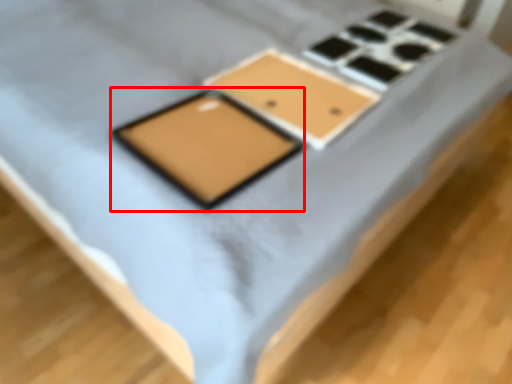
Question: From the image's perspective, where is tablet computer (annotated by the red box) located in relation to rectangle in the image?

Choices:
 (A) below
 (B) above

Answer: (A)